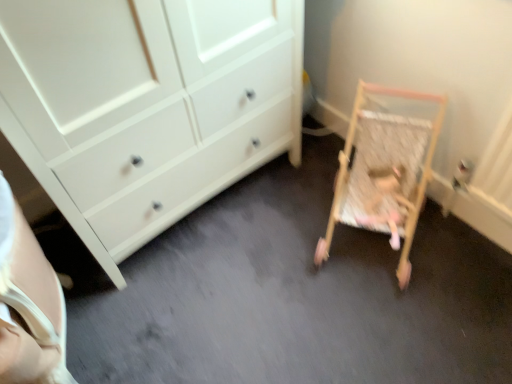
What are the coordinates of `free space in front of wooden baby cot at lower right` in the screenshot? It's located at (397, 326).